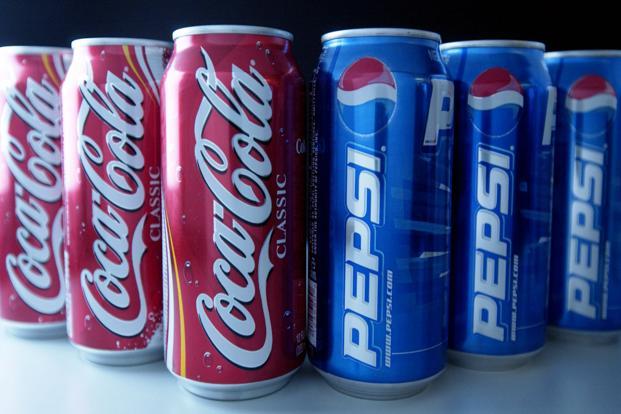
I want to click on shelf, so click(x=440, y=394).